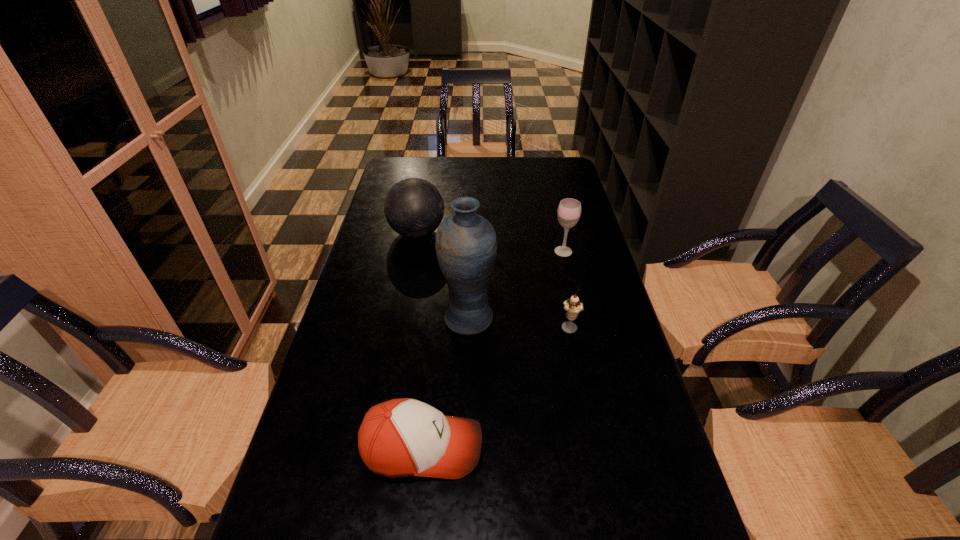
The height and width of the screenshot is (540, 960). I want to click on the tallest object, so click(466, 245).

Locate an element on the screen. Image resolution: width=960 pixels, height=540 pixels. bowling ball is located at coordinates (413, 207).

This screenshot has width=960, height=540. In order to click on wineglass in this screenshot , I will do `click(569, 210)`.

Find the location of a particular element. The height and width of the screenshot is (540, 960). icecream is located at coordinates (573, 306).

You are a GUI agent. You are given a task and a screenshot of the screen. Output one action in this format:
    pyautogui.click(x=<x>, y=<y>)
    Task: Click on the baseball cap
    
    Given the screenshot: What is the action you would take?
    pyautogui.click(x=405, y=437)

Image resolution: width=960 pixels, height=540 pixels. Identify the location of vacant area situated on the back of the tallest object. (470, 248).

Find the location of `vacant area situated 0.310m on the grip area of the bowling ball`. vacant area situated 0.310m on the grip area of the bowling ball is located at coordinates (540, 233).

Where is `vacant point located on the front of the wineglass`? vacant point located on the front of the wineglass is located at coordinates (571, 284).

Image resolution: width=960 pixels, height=540 pixels. Find the location of `vacant region located on the right of the icecream`. vacant region located on the right of the icecream is located at coordinates (599, 329).

This screenshot has height=540, width=960. In order to click on free space located 0.140m on the front-facing side of the baseball cap in this screenshot , I will do `click(551, 447)`.